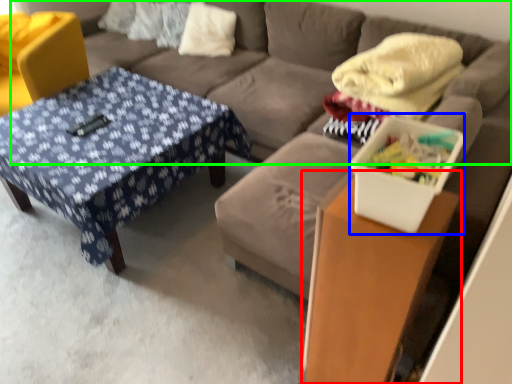
Question: Which object is positioned farthest from table (highlighted by a red box)? Select from storage box (highlighted by a blue box) and futon (highlighted by a green box).

Choices:
 (A) storage box
 (B) futon

Answer: (B)